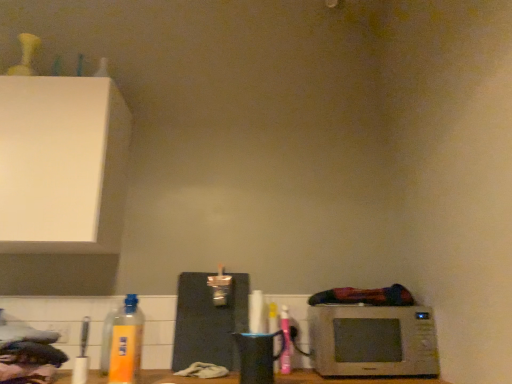
Question: From a real-world perspective, is white plastic electric outlet at lower left beneath black matte cutting board at center?

Choices:
 (A) yes
 (B) no

Answer: (A)

Question: Considering the relative sizes of white plastic electric outlet at lower left and black matte cutting board at center in the image provided, is white plastic electric outlet at lower left taller than black matte cutting board at center?

Choices:
 (A) no
 (B) yes

Answer: (A)

Question: Is white plastic electric outlet at lower left at the right side of black matte cutting board at center?

Choices:
 (A) yes
 (B) no

Answer: (B)

Question: From the image's perspective, is white plastic electric outlet at lower left above black matte cutting board at center?

Choices:
 (A) no
 (B) yes

Answer: (A)

Question: Is black matte cutting board at center surrounded by white plastic electric outlet at lower left?

Choices:
 (A) yes
 (B) no

Answer: (B)

Question: Can we say white plastic electric outlet at lower left lies outside black matte cutting board at center?

Choices:
 (A) no
 (B) yes

Answer: (B)

Question: From the image's perspective, is pink matte spray can at lower right, marked as the 1th bottle in a right-to-left arrangement, beneath yellow matte bottle at lower left, which appears as the 3th bottle when viewed from the right?

Choices:
 (A) yes
 (B) no

Answer: (A)

Question: Can you confirm if pink matte spray can at lower right, the 3th bottle positioned from the left, is smaller than yellow matte bottle at lower left, placed as the 2th bottle when sorted from back to front?

Choices:
 (A) no
 (B) yes

Answer: (B)

Question: Is pink matte spray can at lower right, marked as the 1th bottle in a right-to-left arrangement, bigger than yellow matte bottle at lower left, placed as the 2th bottle when sorted from back to front?

Choices:
 (A) yes
 (B) no

Answer: (B)

Question: Considering the relative sizes of pink matte spray can at lower right, positioned as the 3th bottle in front-to-back order, and yellow matte bottle at lower left, which appears as the 3th bottle when viewed from the right, in the image provided, is pink matte spray can at lower right, positioned as the 3th bottle in front-to-back order, taller than yellow matte bottle at lower left, which appears as the 3th bottle when viewed from the right,?

Choices:
 (A) no
 (B) yes

Answer: (B)

Question: Is pink matte spray can at lower right, arranged as the 1th bottle when viewed from the back, not within yellow matte bottle at lower left, placed as the 2th bottle when sorted from back to front?

Choices:
 (A) no
 (B) yes

Answer: (B)

Question: Could you tell me if pink matte spray can at lower right, arranged as the 1th bottle when viewed from the back, is turned towards yellow matte bottle at lower left, acting as the second bottle starting from the front?

Choices:
 (A) no
 (B) yes

Answer: (A)

Question: From the image's perspective, is pink matte spray can at lower right, marked as the 1th bottle in a right-to-left arrangement, located beneath white plastic electric outlet at lower left?

Choices:
 (A) no
 (B) yes

Answer: (A)